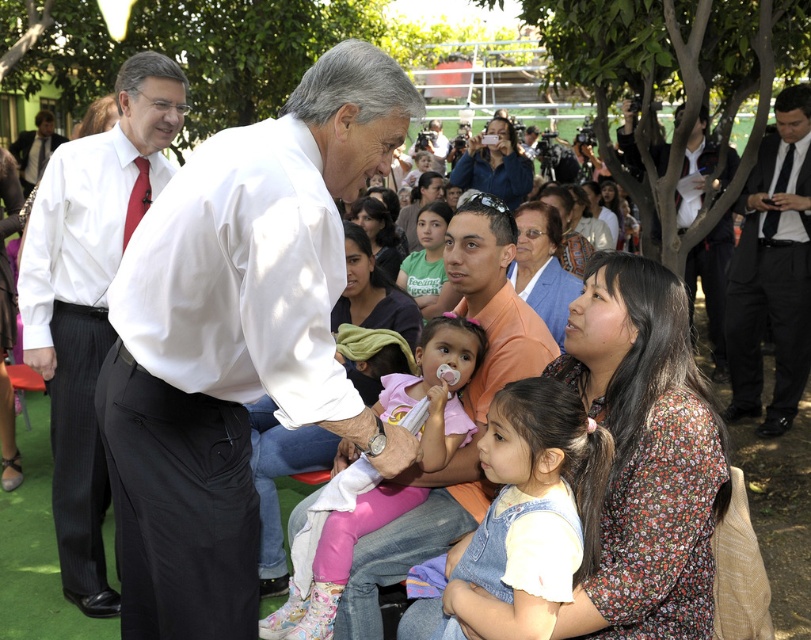
Between denim overalls at center and pink fabric at center, which one has more height?

pink fabric at center is taller.

In the scene shown: Which is more to the left, denim overalls at center or pink fabric at center?

From the viewer's perspective, pink fabric at center appears more on the left side.

What do you see at coordinates (535, 497) in the screenshot? The height and width of the screenshot is (640, 811). I see `denim overalls at center` at bounding box center [535, 497].

You are a GUI agent. You are given a task and a screenshot of the screen. Output one action in this format:
    pyautogui.click(x=<x>, y=<y>)
    Task: Click on the denim overalls at center
    The height and width of the screenshot is (640, 811).
    Given the screenshot: What is the action you would take?
    pyautogui.click(x=535, y=497)

Who is lower down, black suit at right or pink fabric at center?

pink fabric at center

Is black suit at right below pink fabric at center?

Incorrect, black suit at right is not positioned below pink fabric at center.

Identify the location of black suit at right. This screenshot has width=811, height=640. (771, 269).

Between white shirt at left and pink fabric at center, which one appears on the right side from the viewer's perspective?

pink fabric at center is more to the right.

Is white shirt at left further to camera compared to pink fabric at center?

Yes, white shirt at left is behind pink fabric at center.

Who is more distant from viewer, (101, 198) or (337, 563)?

Positioned behind is point (101, 198).

Find the location of `white shirt at left`. white shirt at left is located at coordinates (88, 301).